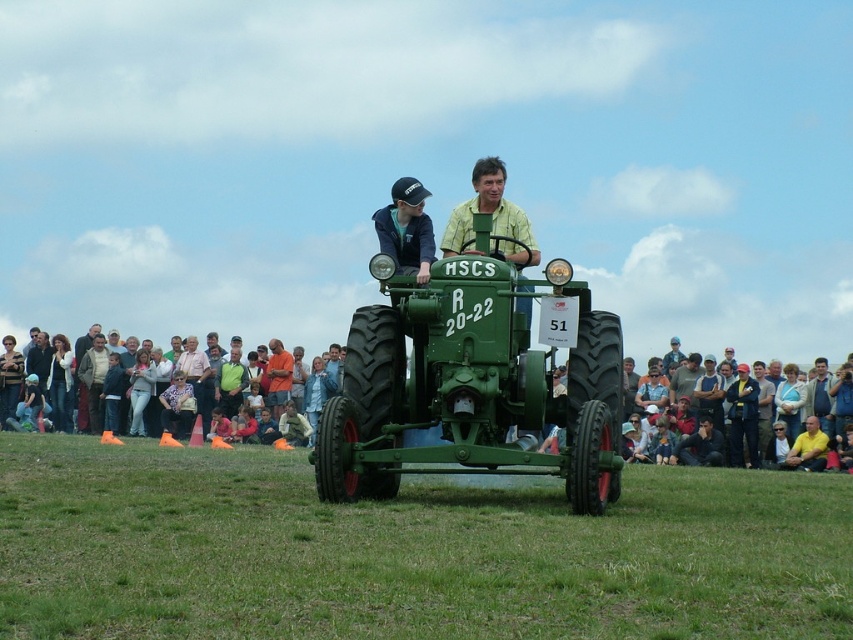
You are a drone operator assigned to capture aerial footage of the green matte tractor at center. The drone has a maximum flight radius of 10 meters from your current position. Can you confirm if the drone can reach the tractor without exceeding its flight radius?

The green matte tractor at center is located at point (469, 385). Since the drone has a maximum flight radius of 10 meters, it can easily reach the tractor without exceeding its limit.

You are standing at the point labeled point (273, 364) and want to walk to the point labeled point (39, 628). Which direction should you face to walk straight towards your destination?

You should face forward because point (39, 628) is in front of point (273, 364).